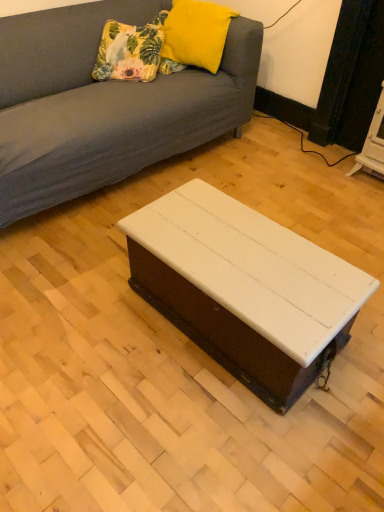
Question: Is white painted wood coffee table at center behind floral fabric cushion at upper left, the 1th pillow when ordered from left to right?

Choices:
 (A) no
 (B) yes

Answer: (A)

Question: Is white painted wood coffee table at center at the left side of floral fabric cushion at upper left, arranged as the second pillow when viewed from the right?

Choices:
 (A) yes
 (B) no

Answer: (B)

Question: Is floral fabric cushion at upper left, the 1th pillow when ordered from left to right, at the back of white painted wood coffee table at center?

Choices:
 (A) no
 (B) yes

Answer: (A)

Question: From a real-world perspective, is white painted wood coffee table at center physically below floral fabric cushion at upper left, the 1th pillow when ordered from left to right?

Choices:
 (A) no
 (B) yes

Answer: (B)

Question: Is white painted wood coffee table at center smaller than floral fabric cushion at upper left, the 1th pillow when ordered from left to right?

Choices:
 (A) no
 (B) yes

Answer: (A)

Question: In the image, is yellow fuzzy pillow at upper center, marked as the first pillow in a right-to-left arrangement, positioned in front of or behind white painted wood coffee table at center?

Choices:
 (A) behind
 (B) front

Answer: (A)

Question: Based on their sizes in the image, would you say yellow fuzzy pillow at upper center, which appears as the second pillow when viewed from the left, is bigger or smaller than white painted wood coffee table at center?

Choices:
 (A) small
 (B) big

Answer: (A)

Question: From a real-world perspective, is yellow fuzzy pillow at upper center, marked as the first pillow in a right-to-left arrangement, positioned above or below white painted wood coffee table at center?

Choices:
 (A) above
 (B) below

Answer: (A)

Question: From the image's perspective, relative to white painted wood coffee table at center, is yellow fuzzy pillow at upper center, marked as the first pillow in a right-to-left arrangement, above or below?

Choices:
 (A) below
 (B) above

Answer: (B)

Question: Based on their sizes in the image, would you say yellow fuzzy pillow at upper center, marked as the first pillow in a right-to-left arrangement, is bigger or smaller than floral fabric cushion at upper left, arranged as the second pillow when viewed from the right?

Choices:
 (A) big
 (B) small

Answer: (A)

Question: Is yellow fuzzy pillow at upper center, marked as the first pillow in a right-to-left arrangement, wider or thinner than floral fabric cushion at upper left, the 1th pillow when ordered from left to right?

Choices:
 (A) wide
 (B) thin

Answer: (B)

Question: From the image's perspective, is yellow fuzzy pillow at upper center, marked as the first pillow in a right-to-left arrangement, above or below floral fabric cushion at upper left, arranged as the second pillow when viewed from the right?

Choices:
 (A) above
 (B) below

Answer: (A)

Question: Considering their positions, is yellow fuzzy pillow at upper center, which appears as the second pillow when viewed from the left, located in front of or behind floral fabric cushion at upper left, the 1th pillow when ordered from left to right?

Choices:
 (A) behind
 (B) front

Answer: (B)

Question: Is white painted wood coffee table at center taller or shorter than yellow fuzzy pillow at upper center, marked as the first pillow in a right-to-left arrangement?

Choices:
 (A) tall
 (B) short

Answer: (A)

Question: Relative to yellow fuzzy pillow at upper center, marked as the first pillow in a right-to-left arrangement, is white painted wood coffee table at center in front or behind?

Choices:
 (A) front
 (B) behind

Answer: (A)